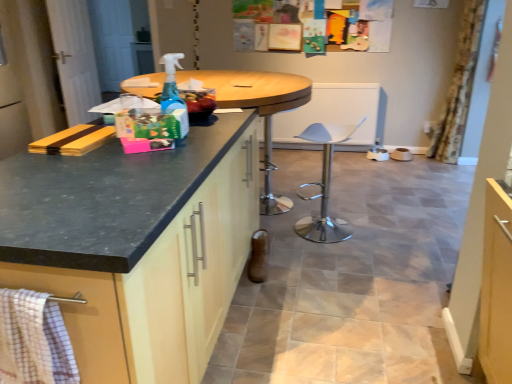
Describe the element at coordinates (324, 187) in the screenshot. This screenshot has width=512, height=384. I see `white plastic swivel chair at center` at that location.

What do you see at coordinates (173, 93) in the screenshot?
I see `transparent plastic spray bottle at center` at bounding box center [173, 93].

From the picture: Measure the distance between transparent plastic spray bottle at center and camera.

They are 1.50 meters apart.

Describe the element at coordinates (34, 340) in the screenshot. This screenshot has width=512, height=384. I see `checkered fabric towel at lower left` at that location.

Locate an element on the screen. white plastic swivel chair at center is located at coordinates tap(324, 187).

Can you tell me how much white wood screen door at left and matte black countertop at left differ in facing direction?

10.8 degrees.

Is white wood screen door at left to the left or to the right of matte black countertop at left in the image?

From the image, it's evident that white wood screen door at left is to the left of matte black countertop at left.

Considering the sizes of white wood screen door at left and matte black countertop at left in the image, is white wood screen door at left bigger or smaller than matte black countertop at left?

Clearly, white wood screen door at left is smaller in size than matte black countertop at left.

From the image's perspective, is white wood screen door at left on matte black countertop at left?

Yes, from the image's perspective, white wood screen door at left is above matte black countertop at left.

Locate an element on the screen. bottle that appears above the white plastic swivel chair at center (from a real-world perspective) is located at coordinates (173, 93).

Do you think white plastic swivel chair at center is within transparent plastic spray bottle at center, or outside of it?

white plastic swivel chair at center lies outside transparent plastic spray bottle at center.

In the scene shown: Which of these two, white plastic swivel chair at center or transparent plastic spray bottle at center, is thinner?

transparent plastic spray bottle at center is thinner.

Based on the photo, does white plastic swivel chair at center have a larger size compared to transparent plastic spray bottle at center?

Yes.

Is transparent plastic spray bottle at center taller or shorter than white plastic swivel chair at center?

Considering their sizes, transparent plastic spray bottle at center has less height than white plastic swivel chair at center.

Between transparent plastic spray bottle at center and white plastic swivel chair at center, which one appears on the left side from the viewer's perspective?

transparent plastic spray bottle at center.

The width and height of the screenshot is (512, 384). What are the coordinates of `swivel chair lying behind the transparent plastic spray bottle at center` in the screenshot? It's located at (324, 187).

Could you tell me if transparent plastic spray bottle at center is facing white plastic swivel chair at center?

No.

Is checkered fabric towel at lower left oriented away from white wood screen door at left?

No, checkered fabric towel at lower left's orientation is not away from white wood screen door at left.

From a real-world perspective, is checkered fabric towel at lower left below white wood screen door at left?

Correct, in the physical world, checkered fabric towel at lower left is lower than white wood screen door at left.

Is checkered fabric towel at lower left taller than white wood screen door at left?

Incorrect, the height of checkered fabric towel at lower left is not larger of that of white wood screen door at left.

Does checkered fabric towel at lower left come in front of white wood screen door at left?

Yes, it is.

From a real-world perspective, is floral fabric curtain at right physically located above or below matte black countertop at left?

Clearly, from a real-world perspective, floral fabric curtain at right is above matte black countertop at left.

Is floral fabric curtain at right oriented towards matte black countertop at left?

No.

From the image's perspective, is floral fabric curtain at right located beneath matte black countertop at left?

No.

Considering the sizes of objects floral fabric curtain at right and matte black countertop at left in the image provided, who is wider, floral fabric curtain at right or matte black countertop at left?

matte black countertop at left is wider.

Considering the sizes of white wood screen door at left and white plastic swivel chair at center in the image, is white wood screen door at left taller or shorter than white plastic swivel chair at center?

Clearly, white wood screen door at left is taller compared to white plastic swivel chair at center.

Is white wood screen door at left completely or partially outside of white plastic swivel chair at center?

white wood screen door at left lies outside white plastic swivel chair at center's area.

Is white wood screen door at left oriented away from white plastic swivel chair at center?

No, white wood screen door at left is not facing away from white plastic swivel chair at center.

From a real-world perspective, which object rests below the other?

matte black countertop at left, from a real-world perspective.

Considering the relative sizes of matte black countertop at left and wooden table at center in the image provided, is matte black countertop at left wider than wooden table at center?

No, matte black countertop at left is not wider than wooden table at center.

Could you tell me if matte black countertop at left is facing wooden table at center?

No, matte black countertop at left is not facing towards wooden table at center.

I want to click on screen door above the matte black countertop at left (from a real-world perspective), so click(x=74, y=58).

What are the coordinates of `bottle in front of the white plastic swivel chair at center` in the screenshot? It's located at (173, 93).

Which object lies further to the anchor point transparent plastic spray bottle at center, white wood screen door at left or floral fabric curtain at right?

Based on the image, floral fabric curtain at right appears to be further to transparent plastic spray bottle at center.

Looking at the image, which one is located further to checkered fabric towel at lower left, transparent plastic spray bottle at center or floral fabric curtain at right?

floral fabric curtain at right is further to checkered fabric towel at lower left.

Estimate the real-world distances between objects in this image. Which object is closer to floral fabric curtain at right, transparent plastic spray bottle at center or white wood screen door at left?

The object closer to floral fabric curtain at right is transparent plastic spray bottle at center.

Which object lies further to the anchor point wooden table at center, floral fabric curtain at right or white plastic swivel chair at center?

Based on the image, floral fabric curtain at right appears to be further to wooden table at center.

When comparing their distances from wooden table at center, does matte black countertop at left or transparent plastic spray bottle at center seem further?

matte black countertop at left is further to wooden table at center.

Looking at the image, which one is located further to matte black countertop at left, floral fabric curtain at right or checkered fabric towel at lower left?

Result: floral fabric curtain at right lies further to matte black countertop at left than the other object.

When comparing their distances from white plastic swivel chair at center, does floral fabric curtain at right or checkered fabric towel at lower left seem further?

Based on the image, checkered fabric towel at lower left appears to be further to white plastic swivel chair at center.

Considering their positions, is floral fabric curtain at right positioned further to wooden table at center than transparent plastic spray bottle at center?

floral fabric curtain at right.

Where is `table between checkered fabric towel at lower left and white wood screen door at left in the front-back direction`? Image resolution: width=512 pixels, height=384 pixels. table between checkered fabric towel at lower left and white wood screen door at left in the front-back direction is located at coordinates (258, 108).

Locate an element on the screen. The image size is (512, 384). bottle located between matte black countertop at left and white wood screen door at left in the depth direction is located at coordinates (173, 93).

Locate an element on the screen. The height and width of the screenshot is (384, 512). table between checkered fabric towel at lower left and floral fabric curtain at right in the horizontal direction is located at coordinates (258, 108).

Locate an element on the screen. bottle between matte black countertop at left and wooden table at center along the z-axis is located at coordinates (173, 93).